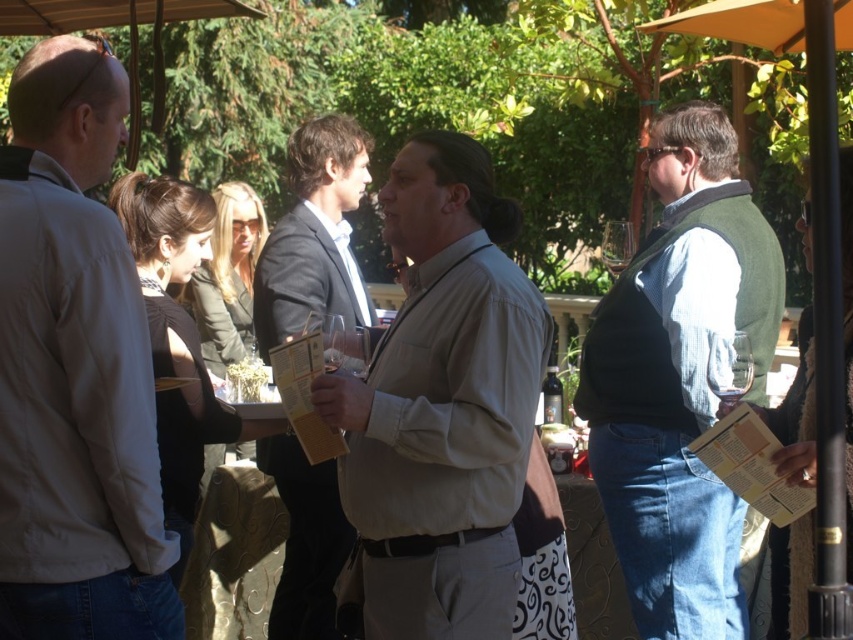
You are organizing a wine tasting event and need to arrange seating based on the attendees clothing. You have two guests wearing the light beige shirt at center and the denim vest at right. Which guest should you seat first if you want to seat the smaller clothing size first?

The light beige shirt at center is smaller than the denim vest at right, so you should seat the guest wearing the light beige shirt at center first.

You are at a wine tasting event and want to approach the person wearing the light beige shirt at left and the denim vest at right. Which one should you walk towards first if you want to greet them in the order they appear closest to you?

You should first approach the light beige shirt at left because it is closer to the viewer than the denim vest at right.